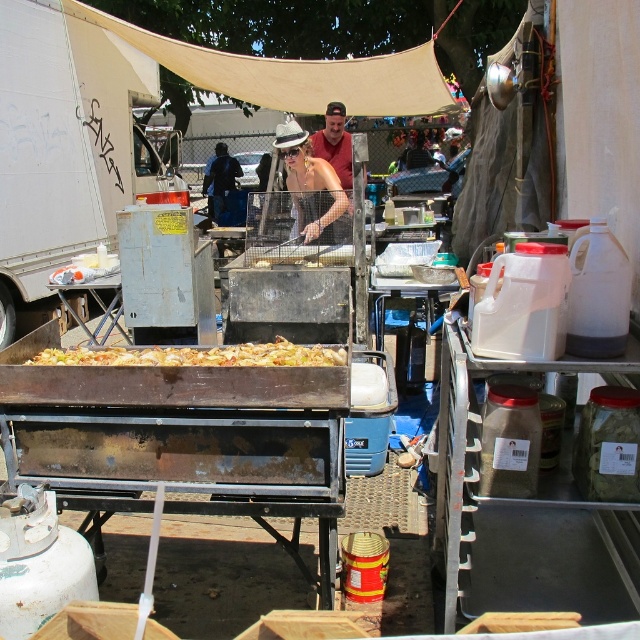
Is golden brown crispy food at center thinner than matte red shirt at center?

Incorrect, golden brown crispy food at center's width is not less than matte red shirt at center's.

Between point (227, 349) and point (337, 161), which one is positioned in front?

Positioned in front is point (227, 349).

Where is `golden brown crispy food at center`? golden brown crispy food at center is located at coordinates (196, 355).